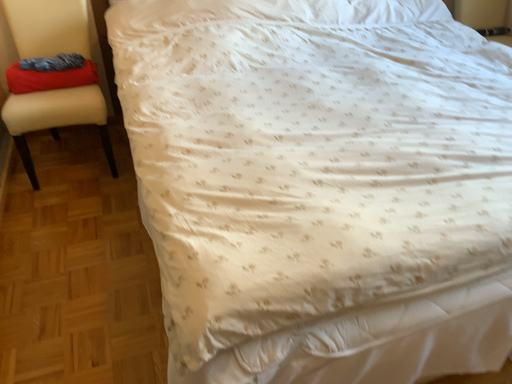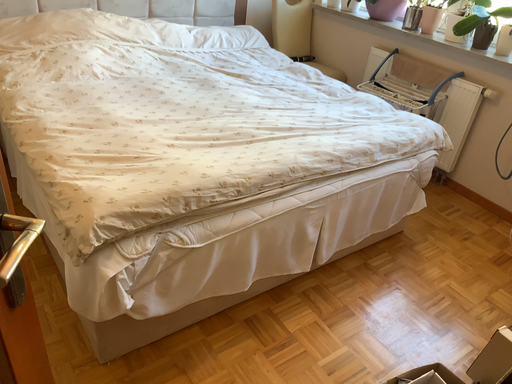
Question: Which way did the camera rotate in the video?

Choices:
 (A) rotated downward
 (B) rotated upward

Answer: (B)